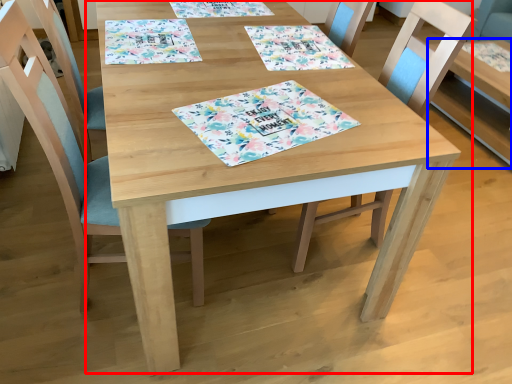
Question: Among these objects, which one is nearest to the camera, table (highlighted by a red box) or table (highlighted by a blue box)?

Choices:
 (A) table
 (B) table

Answer: (A)